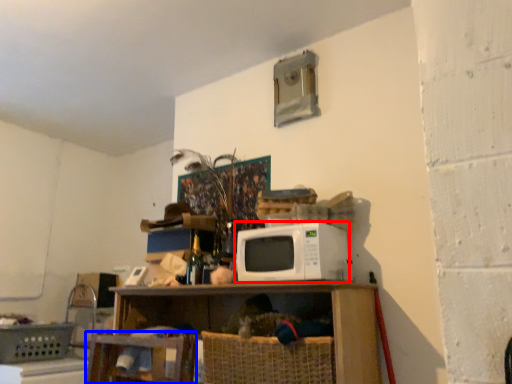
Question: Among these objects, which one is nearest to the camera, microwave oven (highlighted by a red box) or swivel chair (highlighted by a blue box)?

Choices:
 (A) microwave oven
 (B) swivel chair

Answer: (A)